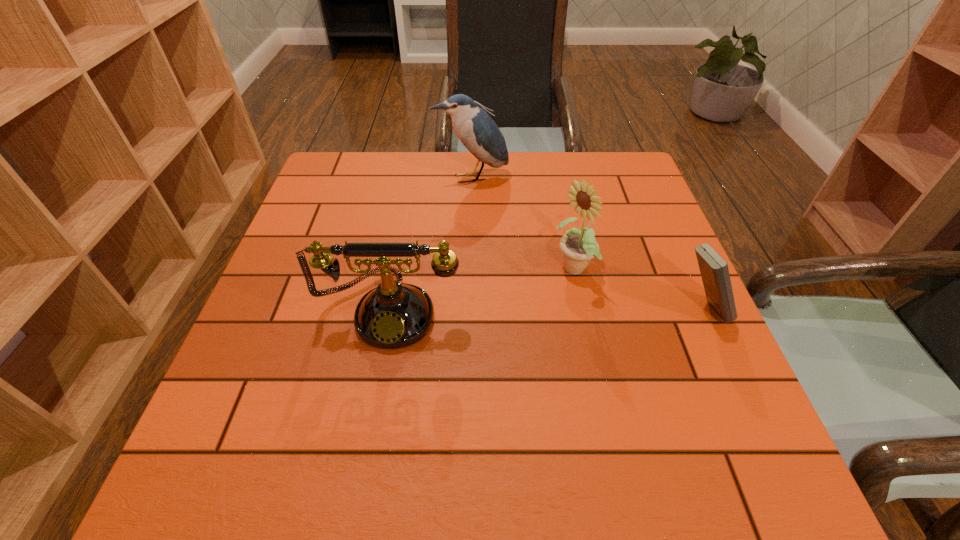
Where is `free space located at the tip of the bird's beak`? Image resolution: width=960 pixels, height=540 pixels. free space located at the tip of the bird's beak is located at coordinates (512, 266).

Find the location of a particular element. The width and height of the screenshot is (960, 540). free space located at the tip of the bird's beak is located at coordinates (511, 264).

You are a GUI agent. You are given a task and a screenshot of the screen. Output one action in this format:
    pyautogui.click(x=<x>, y=<y>)
    Task: Click on the object situated at the far edge
    
    Given the screenshot: What is the action you would take?
    pyautogui.click(x=478, y=132)

You are a GUI agent. You are given a task and a screenshot of the screen. Output one action in this format:
    pyautogui.click(x=<x>, y=<y>)
    Task: Click on the object present at the left edge
    The image size is (960, 540).
    Given the screenshot: What is the action you would take?
    pyautogui.click(x=394, y=315)

Locate an element on the screen. This screenshot has width=960, height=540. object that is at the right edge is located at coordinates (714, 270).

This screenshot has height=540, width=960. Identify the location of vacant space at the far edge of the desktop. (419, 184).

Where is `vacant space at the near edge of the desktop`? The image size is (960, 540). vacant space at the near edge of the desktop is located at coordinates (439, 387).

Where is `blank area at the right edge`? This screenshot has height=540, width=960. blank area at the right edge is located at coordinates (656, 245).

Where is `blank space at the far left corner`? blank space at the far left corner is located at coordinates (337, 193).

The image size is (960, 540). In order to click on vacant region at the far right corner of the desktop in this screenshot , I will do `click(605, 182)`.